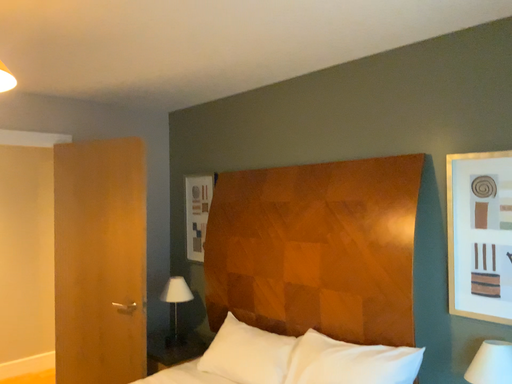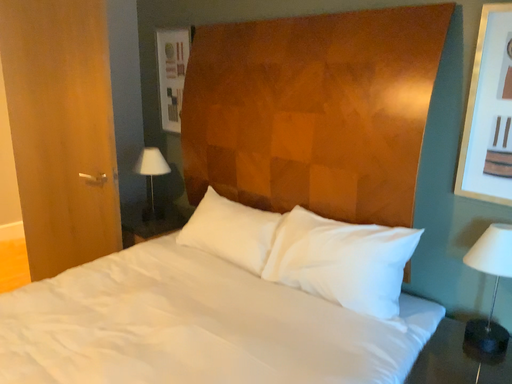
Question: Which way did the camera rotate in the video?

Choices:
 (A) rotated downward
 (B) rotated upward

Answer: (A)